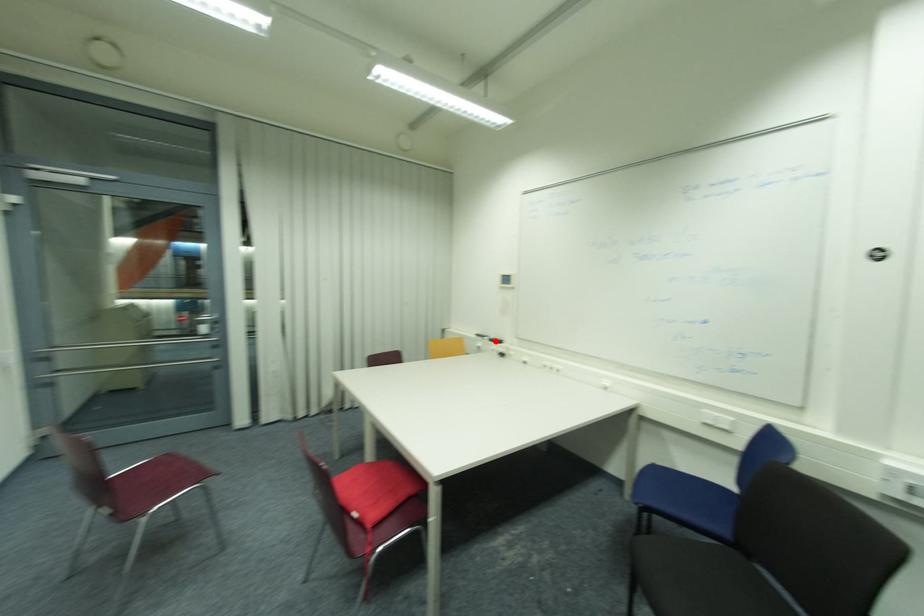
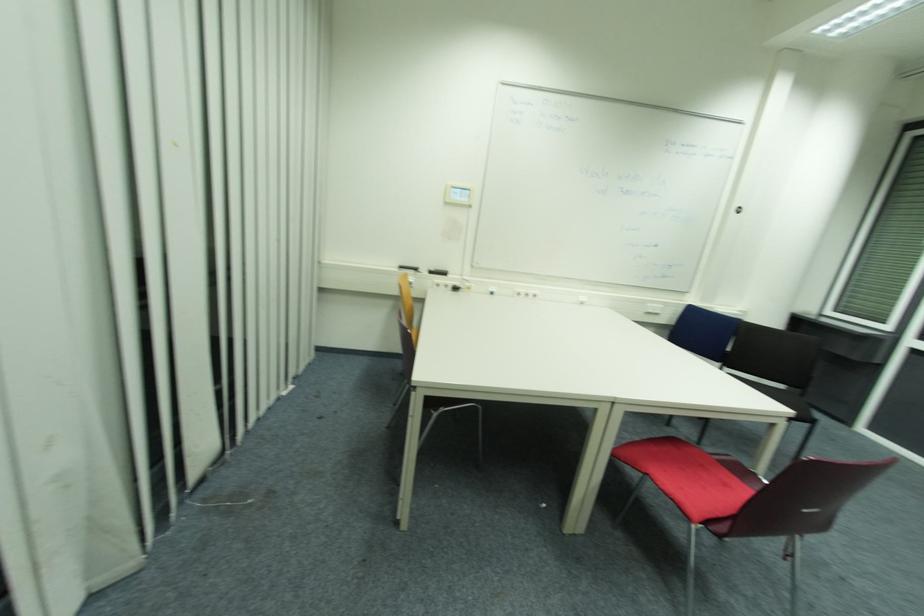
Question: I am providing you with two images of the same scene from different viewpoints. A red point is marked on the first image. Is the red point's position out of view in image 2?

Choices:
 (A) Yes
 (B) No

Answer: (B)